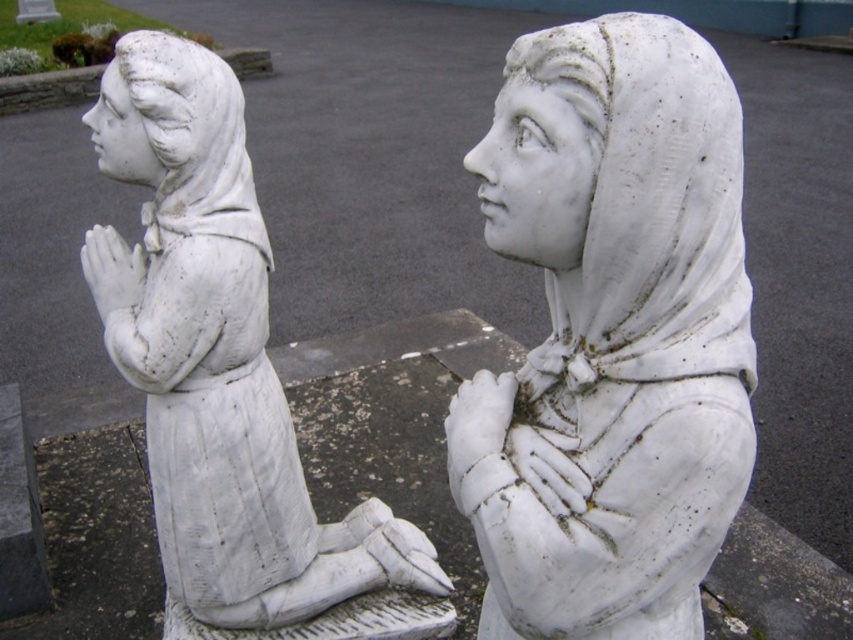
Which is more to the right, white marble statue at center or white marble statue at upper left?

From the viewer's perspective, white marble statue at center appears more on the right side.

Does white marble statue at center have a greater width compared to white marble statue at upper left?

No.

I want to click on white marble statue at center, so click(x=611, y=336).

Where is `white marble statue at center`? The image size is (853, 640). white marble statue at center is located at coordinates (611, 336).

Does white marble statue at center have a lesser height compared to white marble statue at left?

Yes.

Is white marble statue at center below white marble statue at left?

No.

Where is `white marble statue at center`? white marble statue at center is located at coordinates (611, 336).

Describe the element at coordinates (218, 364) in the screenshot. I see `white marble statue at left` at that location.

Who is shorter, white marble statue at left or white marble statue at upper left?

white marble statue at upper left

Identify the location of white marble statue at left. (218, 364).